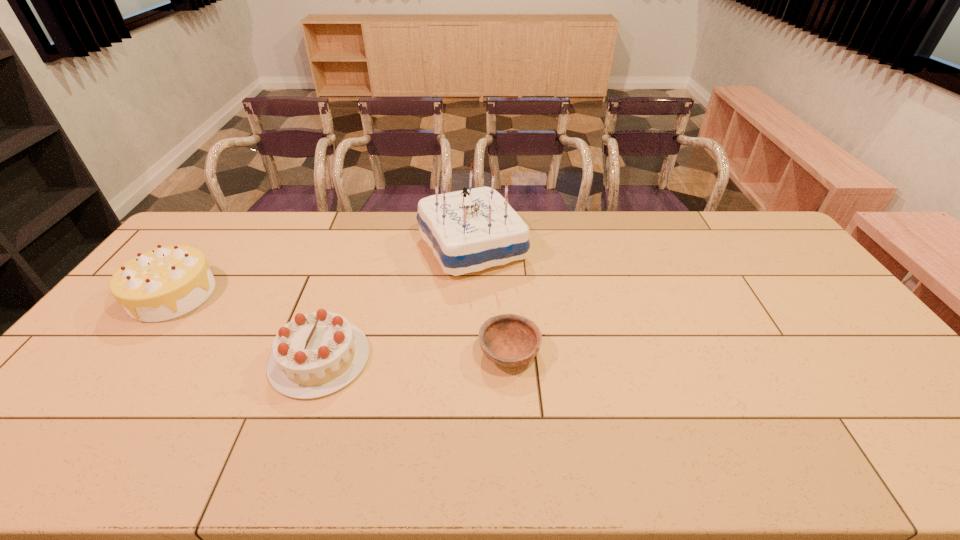
I want to click on the rightmost birthday cake, so click(x=470, y=230).

The image size is (960, 540). In order to click on the tallest object in this screenshot , I will do point(470,230).

This screenshot has width=960, height=540. I want to click on the second shortest birthday cake, so click(165, 283).

The height and width of the screenshot is (540, 960). I want to click on the second tallest object, so click(165, 283).

This screenshot has width=960, height=540. In order to click on the third object from right to left in this screenshot , I will do `click(316, 354)`.

The width and height of the screenshot is (960, 540). I want to click on the shortest birthday cake, so click(x=316, y=354).

Find the location of a particular element. the shortest object is located at coordinates (509, 340).

What are the coordinates of `vacant region located on the left of the tallest object` in the screenshot? It's located at (337, 247).

The image size is (960, 540). I want to click on free location located on the front of the second tallest object, so click(x=93, y=399).

Where is `free space located 0.060m on the back of the third object from right to left`? free space located 0.060m on the back of the third object from right to left is located at coordinates (337, 308).